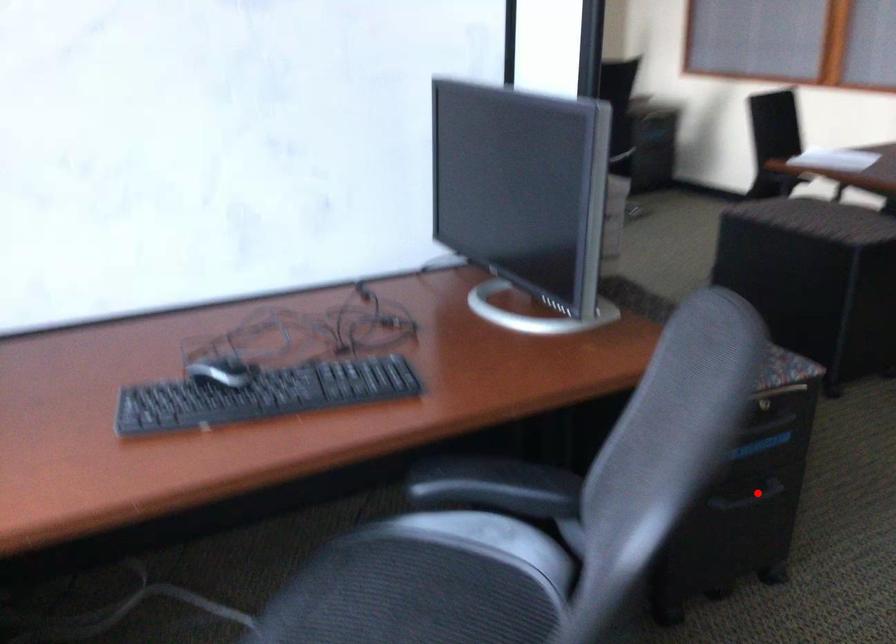
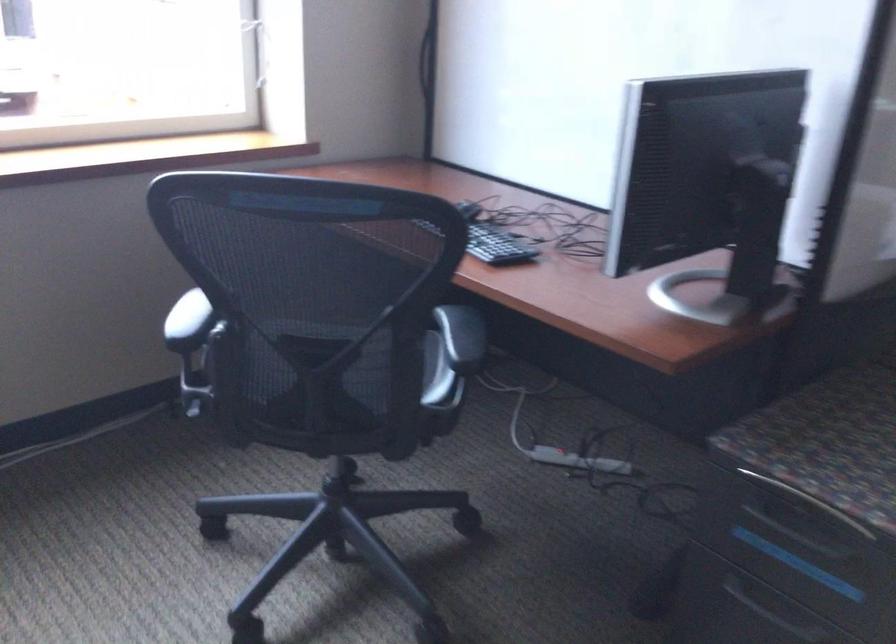
Question: I am providing you with two images of the same scene from different viewpoints. Image1 has a red point marked. In image2, the corresponding 3D location appears at what relative position? Reply with the corresponding letter.

Choices:
 (A) Closer
 (B) Farther

Answer: (A)